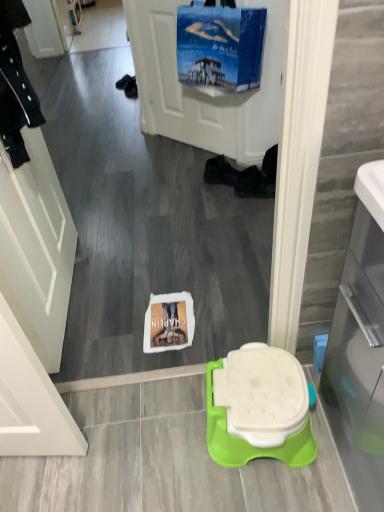
Locate an element on the screen. The width and height of the screenshot is (384, 512). free region on the left part of black fabric shoe at center, acting as the first footwear starting from the right is located at coordinates (215, 200).